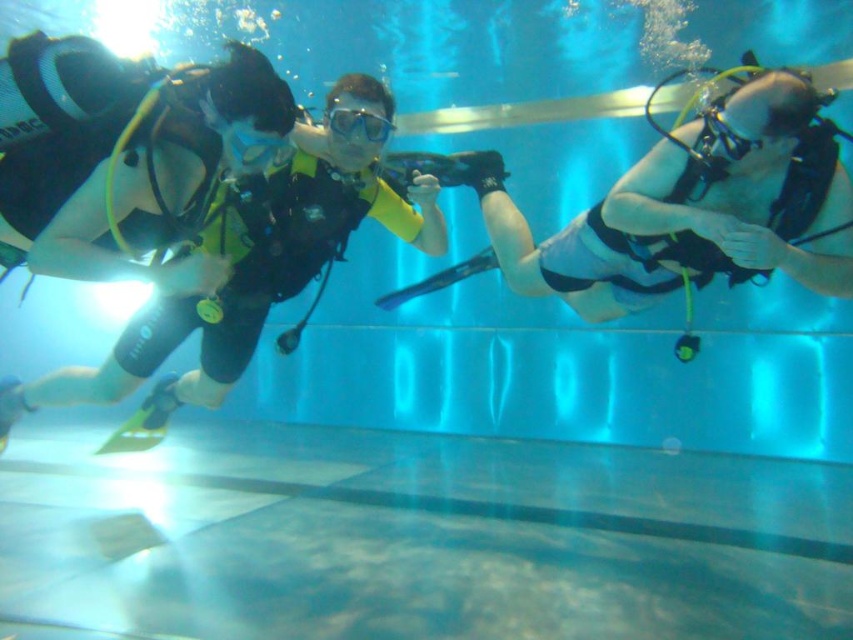
Question: Which object is the farthest from the clear plastic goggles at center?

Choices:
 (A) black matte scuba diver at center
 (B) transparent rubber goggles at center
 (C) matte black scuba gear at center

Answer: (B)

Question: Does black matte scuba diver at center appear over transparent rubber goggles at center?

Choices:
 (A) no
 (B) yes

Answer: (A)

Question: Does matte black scuba gear at center appear on the right side of clear plastic goggles at center?

Choices:
 (A) no
 (B) yes

Answer: (B)

Question: Which point appears closest to the camera in this image?

Choices:
 (A) (238, 307)
 (B) (329, 108)
 (C) (717, 131)
 (D) (639, 301)

Answer: (C)

Question: Which of the following is the closest to the observer?

Choices:
 (A) clear plastic goggles at center
 (B) black matte scuba diver at center

Answer: (B)

Question: Does clear plastic goggles at center appear on the left side of transparent rubber goggles at center?

Choices:
 (A) yes
 (B) no

Answer: (A)